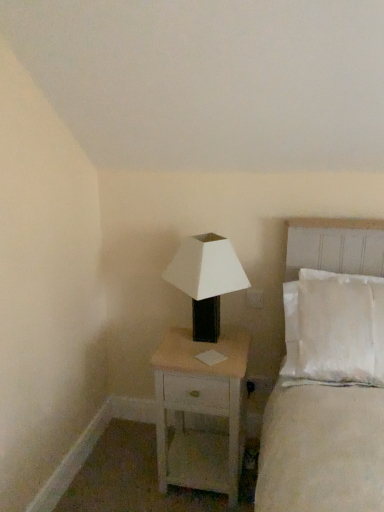
Question: In terms of width, does white cotton bed at right look wider or thinner when compared to white wood nightstand at center?

Choices:
 (A) wide
 (B) thin

Answer: (B)

Question: Considering the positions of white cotton bed at right and white wood nightstand at center in the image, is white cotton bed at right taller or shorter than white wood nightstand at center?

Choices:
 (A) tall
 (B) short

Answer: (A)

Question: Considering the real-world distances, which object is farthest from the white matte/black textured lamp at center?

Choices:
 (A) white wood nightstand at center
 (B) white cotton bed at right

Answer: (B)

Question: Which object is positioned farthest from the white wood nightstand at center?

Choices:
 (A) white matte/black textured lamp at center
 (B) white cotton bed at right

Answer: (B)